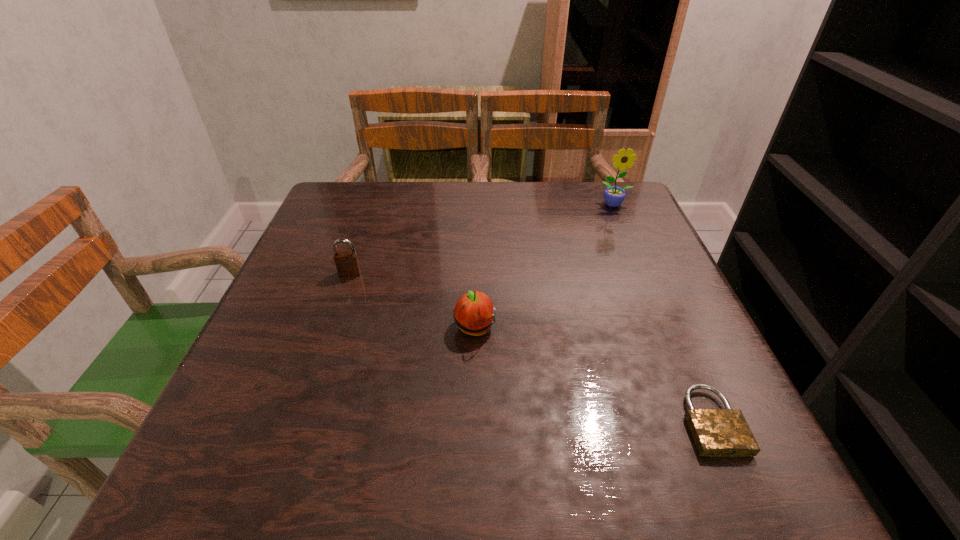
The height and width of the screenshot is (540, 960). Identify the location of vacant space that's between the shorter padlock and the sunflower. (662, 313).

Where is `unoccupied position between the apple and the shortest object`? unoccupied position between the apple and the shortest object is located at coordinates (593, 375).

Find the location of a particular element. The width and height of the screenshot is (960, 540). vacant point located between the third object from right to left and the shortest object is located at coordinates (593, 375).

The width and height of the screenshot is (960, 540). Find the location of `vacant region between the farther padlock and the nearer padlock`. vacant region between the farther padlock and the nearer padlock is located at coordinates (531, 347).

This screenshot has height=540, width=960. In order to click on free space between the third nearest object and the farthest object in this screenshot , I will do `click(482, 239)`.

Identify which object is the closest to the apple. Please provide its 2D coordinates. Your answer should be formatted as a tuple, i.e. [(x, y)], where the tuple contains the x and y coordinates of a point satisfying the conditions above.

[(347, 263)]

Locate an element on the screen. This screenshot has height=540, width=960. object that can be found as the closest to the right padlock is located at coordinates pos(474,312).

Identify the location of free location that satisfies the following two spatial constraints: 1. on the front-facing side of the farther padlock; 2. on the right side of the second object from left to right. The width and height of the screenshot is (960, 540). (331, 328).

The height and width of the screenshot is (540, 960). In order to click on free space in the image that satisfies the following two spatial constraints: 1. on the front-facing side of the leftmost object; 2. on the right side of the apple in this screenshot , I will do `click(331, 328)`.